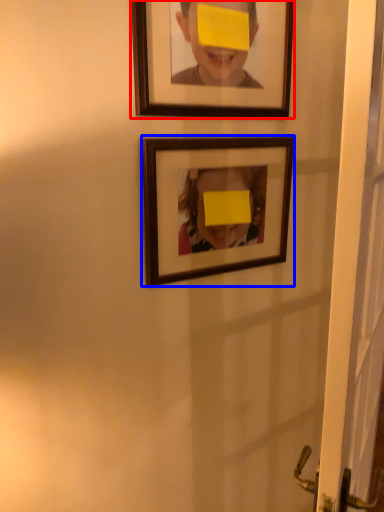
Question: Which object appears closest to the camera in this image, picture frame (highlighted by a red box) or picture frame (highlighted by a blue box)?

Choices:
 (A) picture frame
 (B) picture frame

Answer: (A)